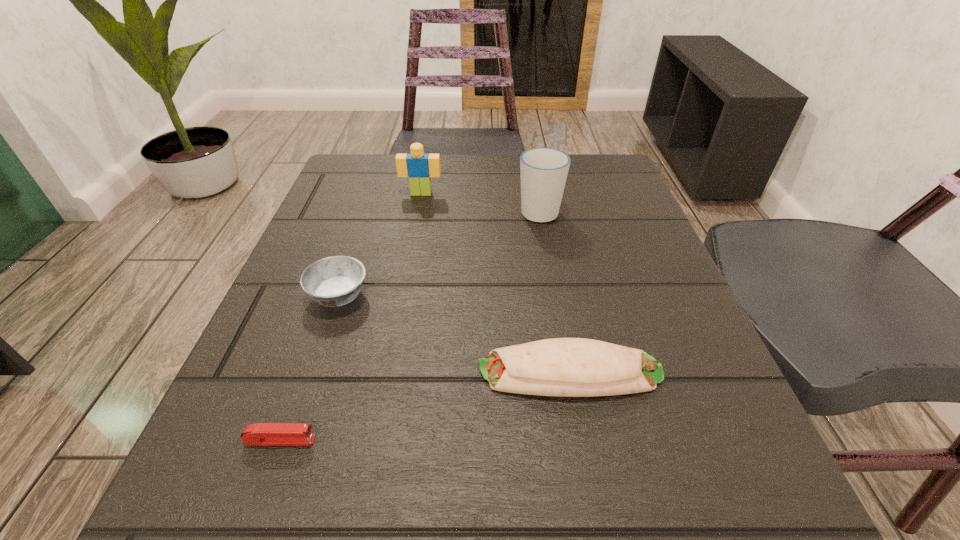
Identify the location of free spot between the fourth tallest object and the third farthest object. The width and height of the screenshot is (960, 540). (454, 334).

This screenshot has height=540, width=960. I want to click on vacant area that lies between the fourth tallest object and the third object from left to right, so click(495, 283).

What are the coordinates of `vacant area between the cup and the Lego` in the screenshot? It's located at (480, 202).

Where is `the fourth closest object to the fourth tallest object`? The height and width of the screenshot is (540, 960). the fourth closest object to the fourth tallest object is located at coordinates (419, 167).

Point out which object is positioned as the nearest to the third object from left to right. Please provide its 2D coordinates. Your answer should be formatted as a tuple, i.e. [(x, y)], where the tuple contains the x and y coordinates of a point satisfying the conditions above.

[(543, 170)]

The width and height of the screenshot is (960, 540). What are the coordinates of `free space in the image that satisfies the following two spatial constraints: 1. on the face of the third object from left to right; 2. on the front-facing side of the nearest object` in the screenshot? It's located at click(x=375, y=440).